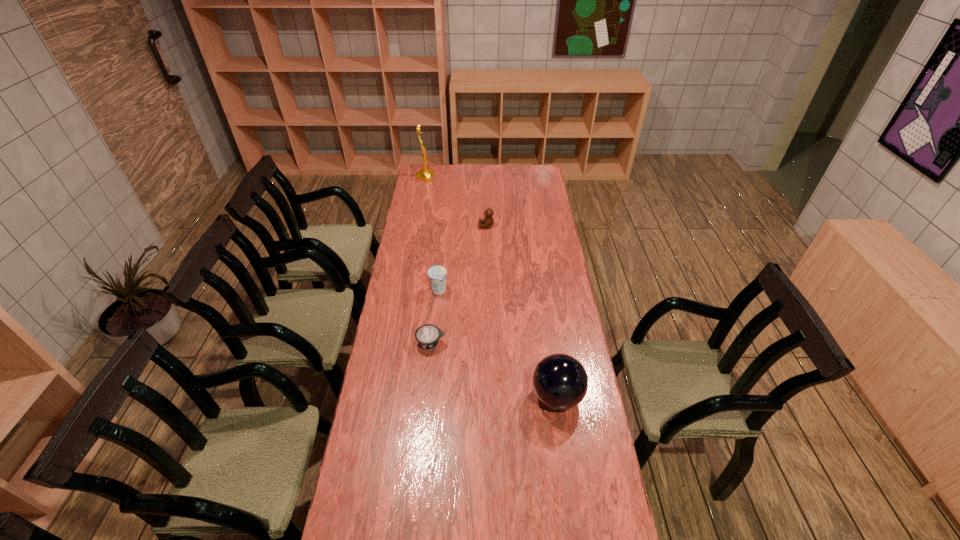
Find the location of a particular element. vacant space located on the front-facing side of the leftmost object is located at coordinates (445, 177).

I want to click on free space located 0.220m on the side of the nearest object with the finger holes, so (468, 396).

Find the location of a particular element. Image resolution: width=960 pixels, height=540 pixels. blank space located on the side of the nearest object with the finger holes is located at coordinates (508, 396).

Find the location of a particular element. Image resolution: width=960 pixels, height=540 pixels. free space located 0.190m on the side of the nearest object with the finger holes is located at coordinates (477, 396).

Where is `free space located on the face of the fourth nearest object`? The height and width of the screenshot is (540, 960). free space located on the face of the fourth nearest object is located at coordinates (419, 226).

Identify the location of vacant area situated 0.320m on the face of the fourth nearest object. The image size is (960, 540). (417, 226).

The image size is (960, 540). I want to click on free spot located on the face of the fourth nearest object, so click(403, 226).

The image size is (960, 540). I want to click on vacant area situated on the back of the taller yogurt, so click(x=441, y=270).

Where is `vacant region located 0.400m on the back of the shorter yogurt`? The height and width of the screenshot is (540, 960). vacant region located 0.400m on the back of the shorter yogurt is located at coordinates (439, 267).

You are a GUI agent. You are given a task and a screenshot of the screen. Output one action in this format:
    pyautogui.click(x=<x>, y=<y>)
    Task: Click on the object that is positioned at the far edge
    
    Given the screenshot: What is the action you would take?
    [x=426, y=174]